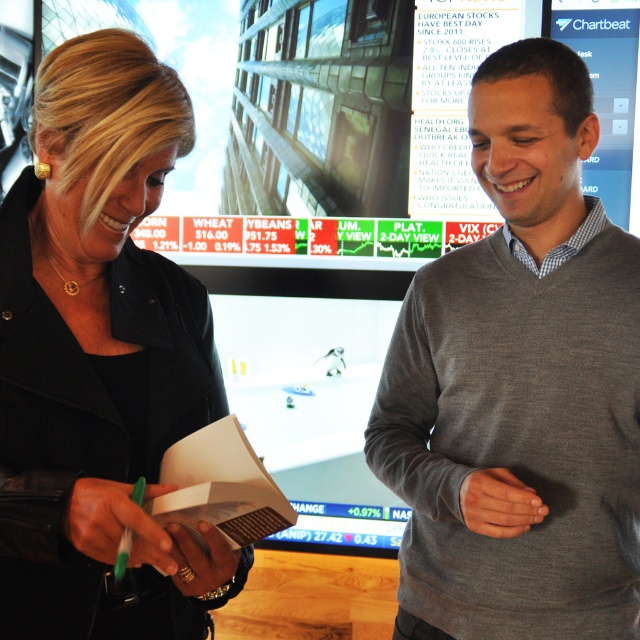
Consider the image. You are standing in the room where the two people are. You need to locate the gray sweater at center. Where is it located in terms of its 2D coordinates?

The gray sweater at center is located at the 2D coordinates of point (518, 385).

You are standing in the room where the two people are talking. You want to place a small plant between the two points, point [573,227] and point [6,253]. Which point should the plant be closer to so that it appears closer to you?

The plant should be placed closer to point [6,253] because it is closer to the camera than point [573,227], making it appear nearer to you.